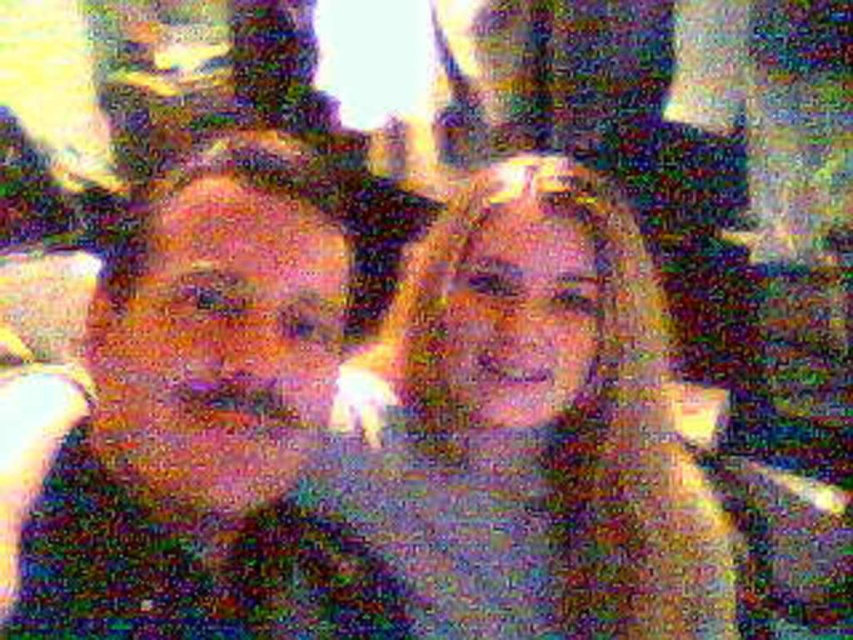
Question: Is matte black face at center above smooth beige sweater at center?

Choices:
 (A) yes
 (B) no

Answer: (A)

Question: Which point is closer to the camera taking this photo?

Choices:
 (A) (83, 273)
 (B) (426, 294)

Answer: (B)

Question: Which point is closer to the camera?

Choices:
 (A) (38, 627)
 (B) (589, 433)

Answer: (A)

Question: Can you confirm if matte black face at center is positioned to the left of smooth beige sweater at center?

Choices:
 (A) no
 (B) yes

Answer: (B)

Question: Is matte black face at center wider than smooth beige sweater at center?

Choices:
 (A) yes
 (B) no

Answer: (B)